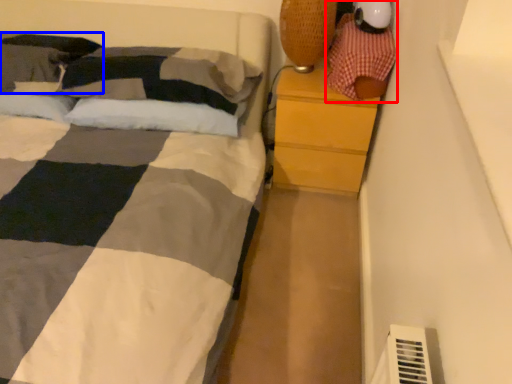
Question: Which object appears farthest to the camera in this image, toy (highlighted by a red box) or pillow (highlighted by a blue box)?

Choices:
 (A) toy
 (B) pillow

Answer: (B)